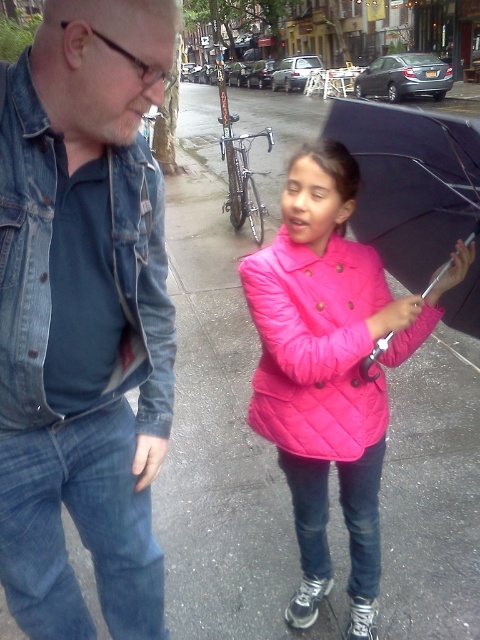
Is denim jacket at left smaller than pink quilted jacket at center?

Yes.

Between denim jacket at left and pink quilted jacket at center, which one has less height?

denim jacket at left

Where is `denim jacket at left`? The image size is (480, 640). denim jacket at left is located at coordinates (84, 317).

The height and width of the screenshot is (640, 480). What do you see at coordinates (330, 369) in the screenshot?
I see `pink quilted jacket at center` at bounding box center [330, 369].

Does pink quilted jacket at center have a greater width compared to black matte umbrella at center?

Correct, the width of pink quilted jacket at center exceeds that of black matte umbrella at center.

What are the coordinates of `pink quilted jacket at center` in the screenshot? It's located at (330, 369).

At what (x,y) coordinates should I click in order to perform the action: click on pink quilted jacket at center. Please return your answer as a coordinate pair (x, y). This screenshot has height=640, width=480. Looking at the image, I should click on (330, 369).

Can you confirm if quilted pink coat at center is thinner than black matte umbrella at center?

No.

Describe the element at coordinates (315, 346) in the screenshot. I see `quilted pink coat at center` at that location.

Which is behind, point (272, 413) or point (374, 134)?

The point (374, 134) is more distant.

Find the location of a particular element. quilted pink coat at center is located at coordinates (315, 346).